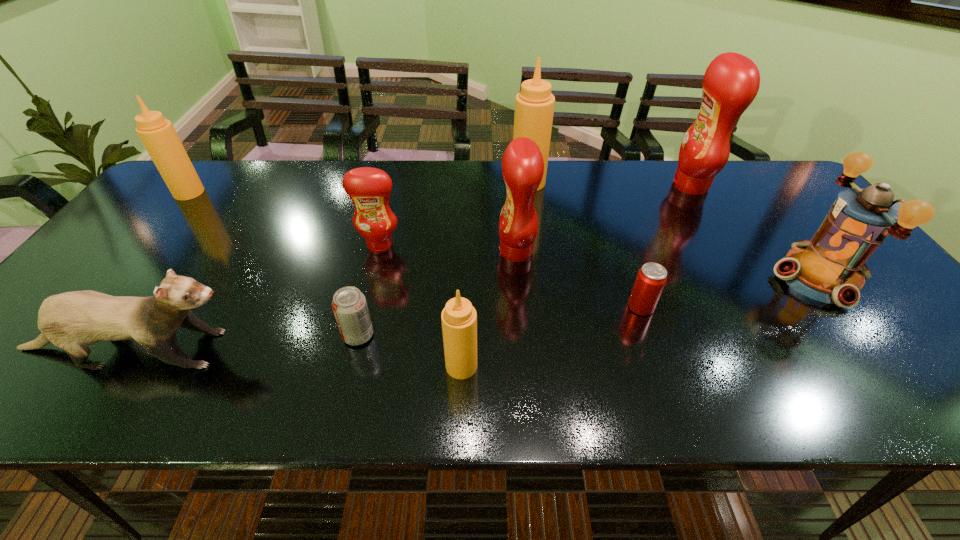
The width and height of the screenshot is (960, 540). Identify the location of the third condiment from left to right. (459, 318).

Locate an element on the screen. Image resolution: width=960 pixels, height=540 pixels. soda can is located at coordinates (349, 305).

Where is `can`? The image size is (960, 540). can is located at coordinates (651, 278).

Where is `red can`? The width and height of the screenshot is (960, 540). red can is located at coordinates (651, 278).

Locate an element on the screen. This screenshot has height=540, width=960. free location located on the label side of the ninth object from left to right is located at coordinates (623, 185).

Where is `free space located 0.270m on the label side of the ninth object from left to right`? This screenshot has width=960, height=540. free space located 0.270m on the label side of the ninth object from left to right is located at coordinates (585, 185).

This screenshot has height=540, width=960. Find the location of `free space located 0.050m on the label side of the ninth object from left to right`. free space located 0.050m on the label side of the ninth object from left to right is located at coordinates (656, 185).

This screenshot has height=540, width=960. I want to click on blank area located on the left of the biggest tan condiment, so pyautogui.click(x=396, y=183).

The image size is (960, 540). Find the location of `vacant space situated on the front of the leftmost tan condiment`. vacant space situated on the front of the leftmost tan condiment is located at coordinates (121, 276).

Where is `free space located on the label side of the second red condiment from left to right`? The width and height of the screenshot is (960, 540). free space located on the label side of the second red condiment from left to right is located at coordinates (380, 251).